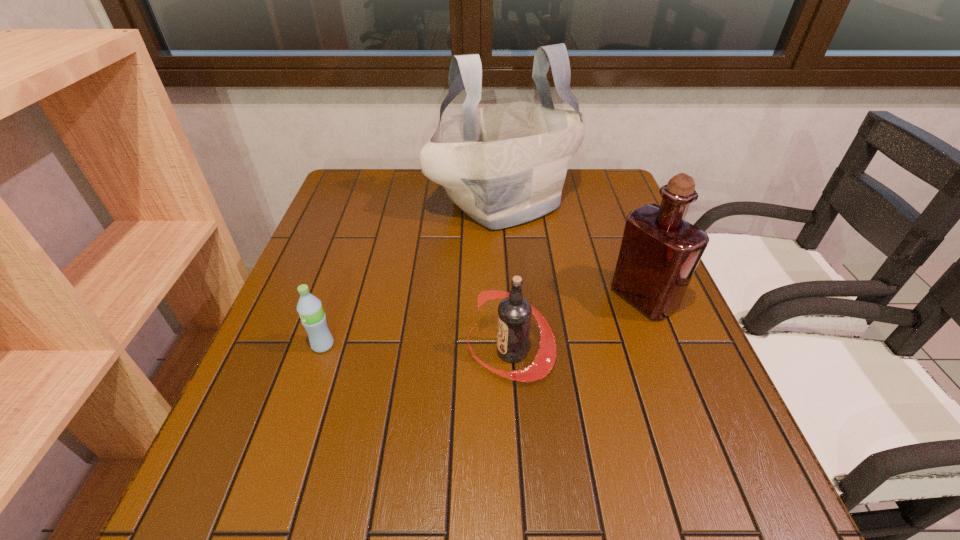
Find the location of a particular element. free point between the farthest object and the shortest object is located at coordinates (413, 274).

Find the location of a particular element. This screenshot has width=960, height=540. vacant point located between the shopping bag and the shortest object is located at coordinates (413, 274).

At what (x,y) coordinates should I click in order to perform the action: click on empty location between the shortest object and the shopping bag. Please return your answer as a coordinate pair (x, y). The height and width of the screenshot is (540, 960). Looking at the image, I should click on (413, 274).

Locate an element on the screen. Image resolution: width=960 pixels, height=540 pixels. free space between the rightmost object and the tallest object is located at coordinates (573, 251).

You are a GUI agent. You are given a task and a screenshot of the screen. Output one action in this format:
    pyautogui.click(x=<x>, y=<y>)
    Task: Click on the object that is the third closest to the second tallest object
    This screenshot has height=540, width=960.
    Given the screenshot: What is the action you would take?
    pyautogui.click(x=309, y=307)

Identify which object is the nearest to the farthest object. Please provide its 2D coordinates. Your answer should be formatted as a tuple, i.e. [(x, y)], where the tuple contains the x and y coordinates of a point satisfying the conditions above.

[(659, 252)]